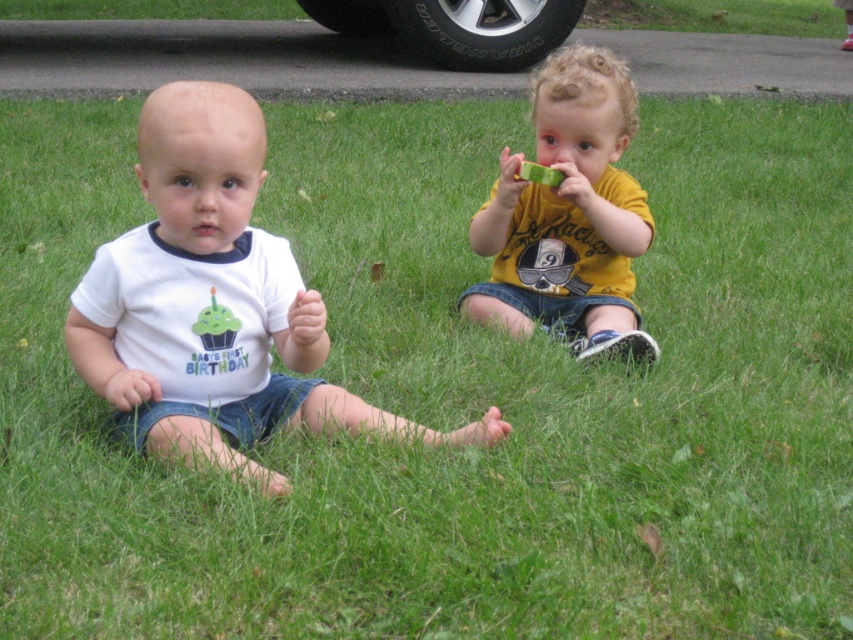
Can you confirm if white cotton shirt at left is smaller than yellow matte shirt at center?

No, white cotton shirt at left is not smaller than yellow matte shirt at center.

Can you confirm if white cotton shirt at left is taller than yellow matte shirt at center?

Incorrect, white cotton shirt at left's height is not larger of yellow matte shirt at center's.

Image resolution: width=853 pixels, height=640 pixels. In order to click on white cotton shirt at left in this screenshot , I will do `click(213, 304)`.